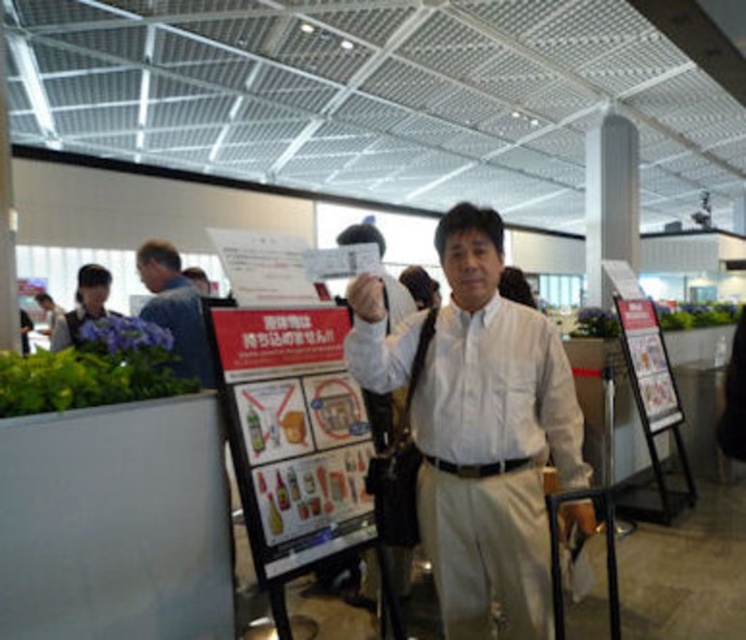
In the scene shown: You are a photographer trying to capture a group photo of two people wearing the white smooth shirt at center and the blue denim shirt at left. If you want to ensure both shirts are fully visible in the frame, which shirt should you position closer to the camera?

The white smooth shirt at center has a smaller width than the blue denim shirt at left. To ensure both shirts are fully visible in the frame, position the wider blue denim shirt at left closer to the camera so that its larger size can be accommodated within the photo without being cropped.

In the scene shown: You are trying to decide which shirt to wear for a casual event. You have a white smooth shirt at center and a matte black shirt at left. Based on the image, which shirt has a wider width?

The white smooth shirt at center has a larger width than the matte black shirt at left according to the description.